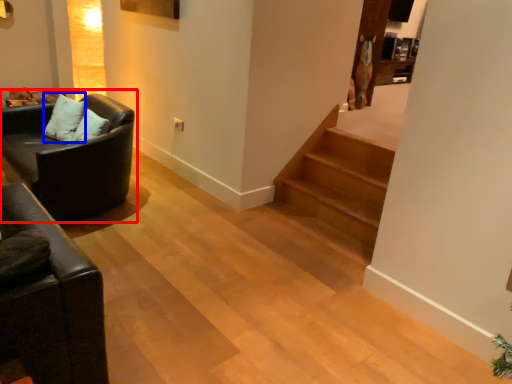
Question: Which of the following is the farthest to the observer, studio couch (highlighted by a red box) or pillow (highlighted by a blue box)?

Choices:
 (A) studio couch
 (B) pillow

Answer: (B)